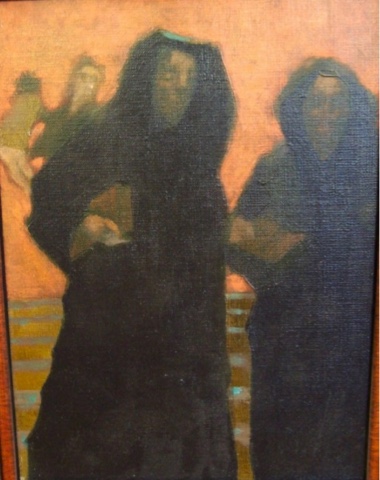
Where is `hood`? This screenshot has height=480, width=380. hood is located at coordinates (143, 58).